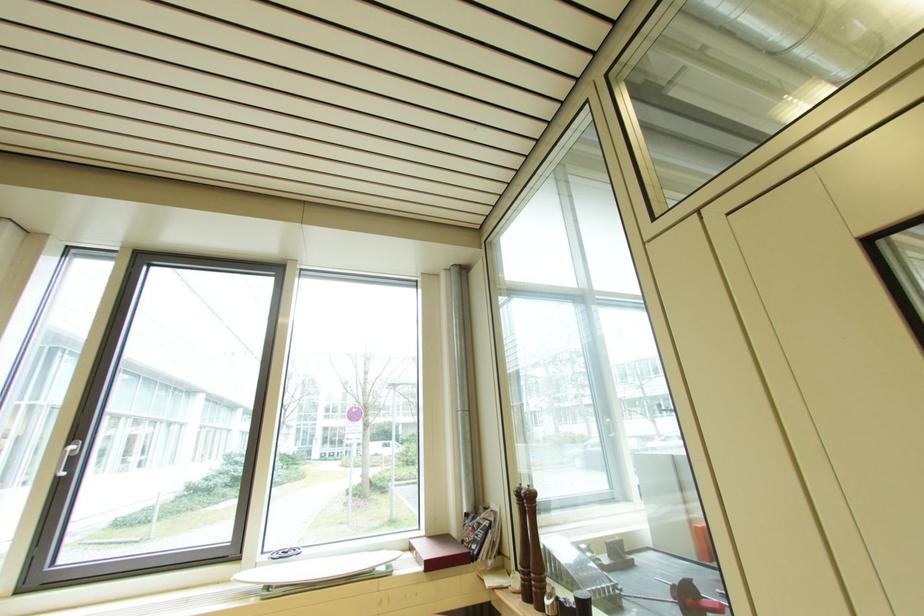
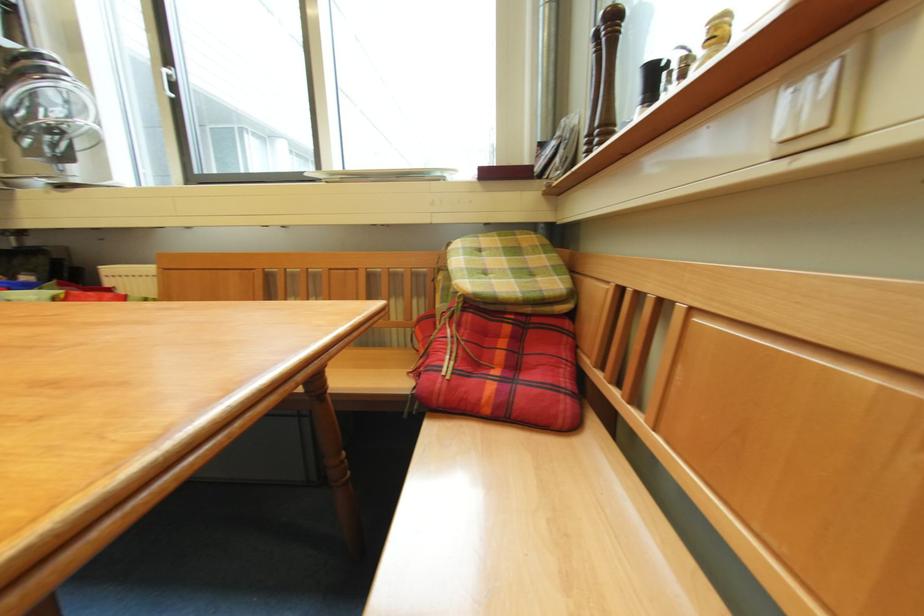
From the picture: First-person continuous shooting, in which direction is the camera rotating?

The rotation direction of the camera is left-down.